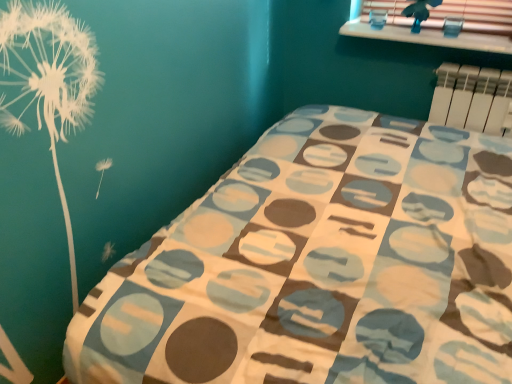
What do you see at coordinates (431, 36) in the screenshot?
I see `metallic copper pipes at upper right` at bounding box center [431, 36].

In the scene shown: Measure the distance between metallic copper pipes at upper right and camera.

5.84 feet.

Where is `metallic copper pipes at upper right`? This screenshot has width=512, height=384. metallic copper pipes at upper right is located at coordinates (431, 36).

Locate an element on the screen. The image size is (512, 384). metallic copper pipes at upper right is located at coordinates (431, 36).